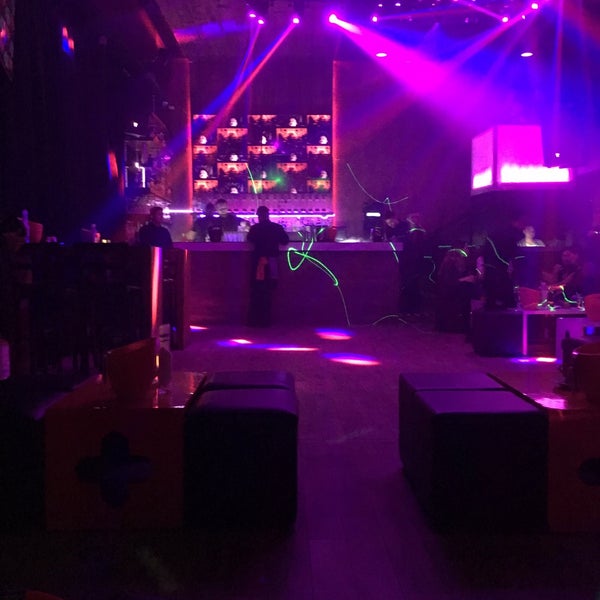
Image resolution: width=600 pixels, height=600 pixels. What are the coordinates of `floor` in the screenshot? It's located at (334, 444).